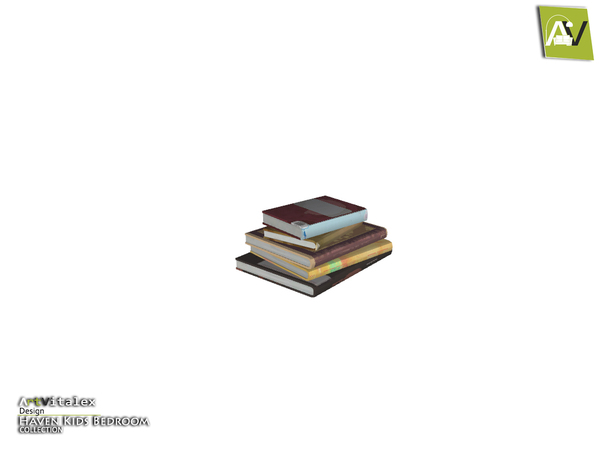
The width and height of the screenshot is (600, 450). I want to click on space to left of books, so click(129, 259).